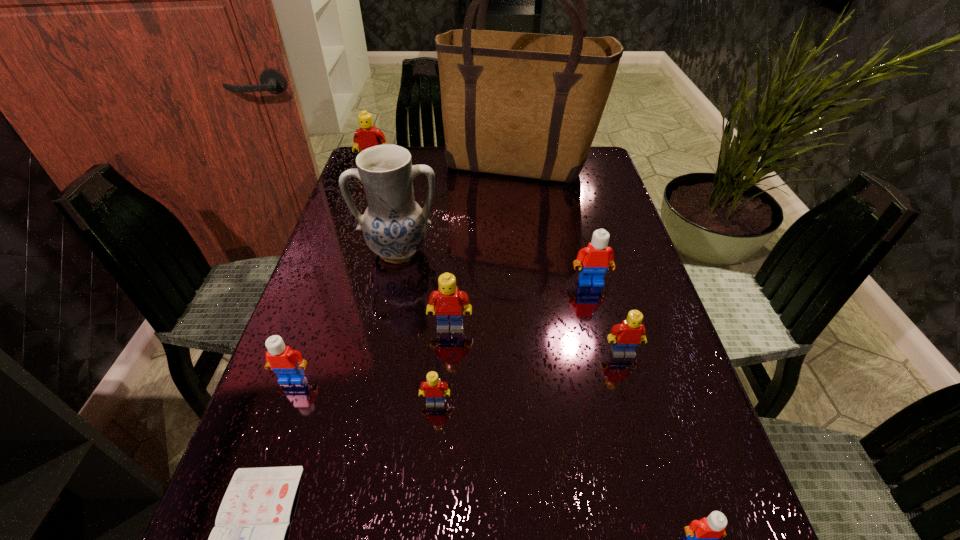
This screenshot has width=960, height=540. I want to click on free space located 0.120m on the face of the third nearest Lego, so click(268, 447).

The image size is (960, 540). Identify the location of vacant region located on the front-facing side of the second nearest yellow Lego. (663, 496).

I want to click on vacant space located 0.150m on the front-facing side of the smallest yellow Lego, so click(428, 495).

The width and height of the screenshot is (960, 540). In order to click on tote bag at the far edge in this screenshot , I will do `click(521, 104)`.

Find the location of `Lego that is at the far edge`. Lego that is at the far edge is located at coordinates (367, 136).

Identify the location of pottery present at the left edge. The image size is (960, 540). (394, 226).

Where is `tote bag that is at the right edge`? tote bag that is at the right edge is located at coordinates click(x=521, y=104).

What are the coordinates of `object at the far left corner` in the screenshot? It's located at (367, 136).

At what (x,y) coordinates should I click in order to perform the action: click on object that is at the far right corner. Please return your answer as a coordinate pair (x, y). This screenshot has height=540, width=960. Looking at the image, I should click on (521, 104).

Identify the location of free point at the far edge. This screenshot has width=960, height=540. (516, 185).